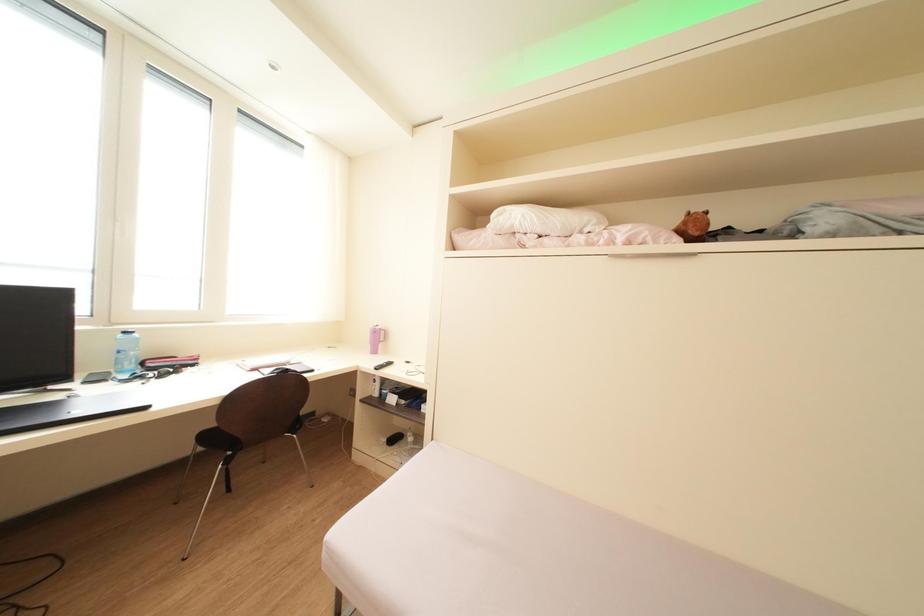
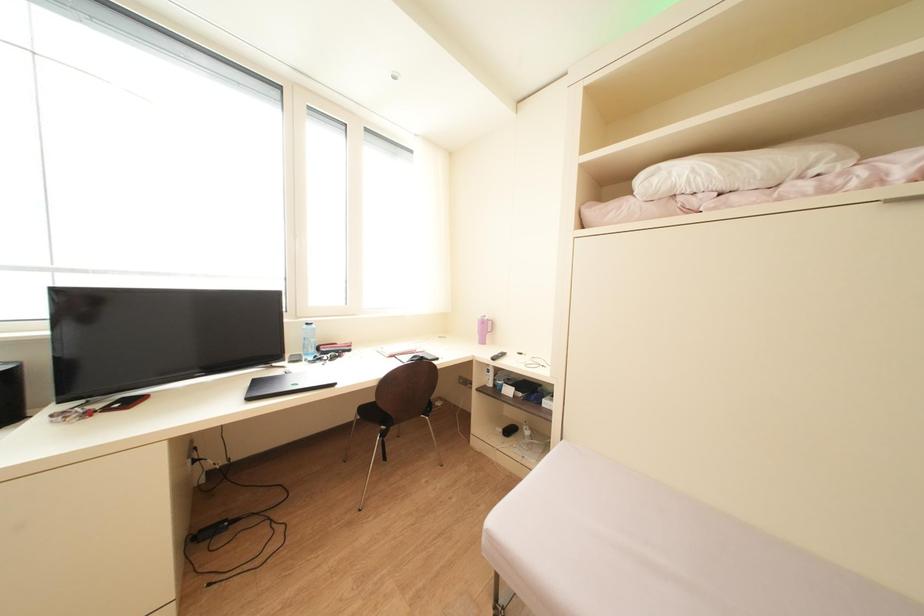
Question: Based on the continuous images, in which direction is the camera rotating? Reply with the corresponding letter.

Choices:
 (A) Left
 (B) Right
 (C) Up
 (D) Down

Answer: (A)